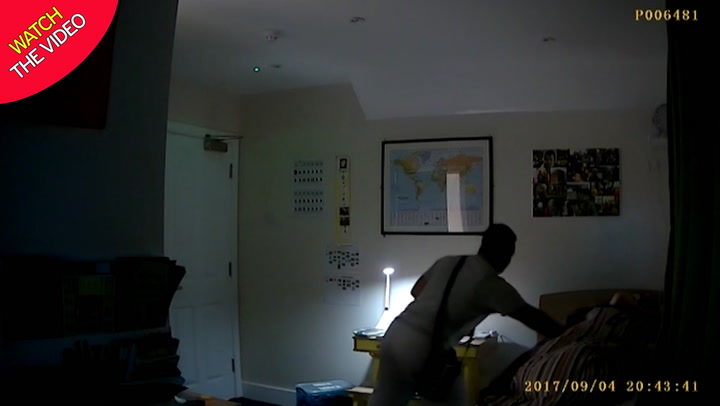
Identify the location of wall above door. The image size is (720, 406). (184, 107).